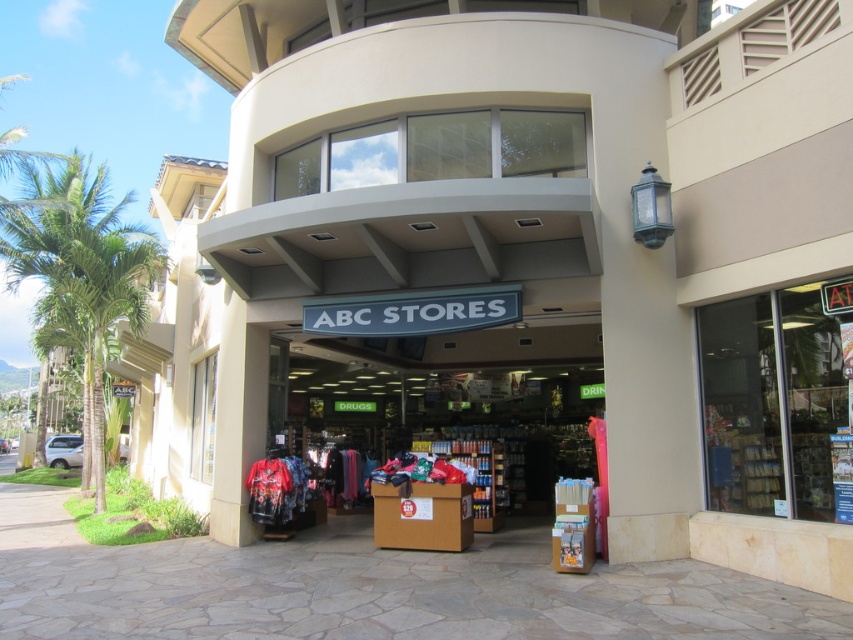
You are standing at the entrance of the ABC Stores location. There is a point labeled at coordinates point [775,404]. What object is located at that point?

The point [775,404] indicates the clear glass door at center.

You are a delivery person with a cart that is 1.2 meters wide. You need to enter the ABC Stores through the entrance shown. Is there enough space between the clear glass door at center and the green leafy palm tree at left to maneuver your cart?

The clear glass door at center is 11.90 meters from the green leafy palm tree at left. Since the distance between them is significantly larger than the cart width of 1.2 meters, there is ample space to maneuver the cart between them.